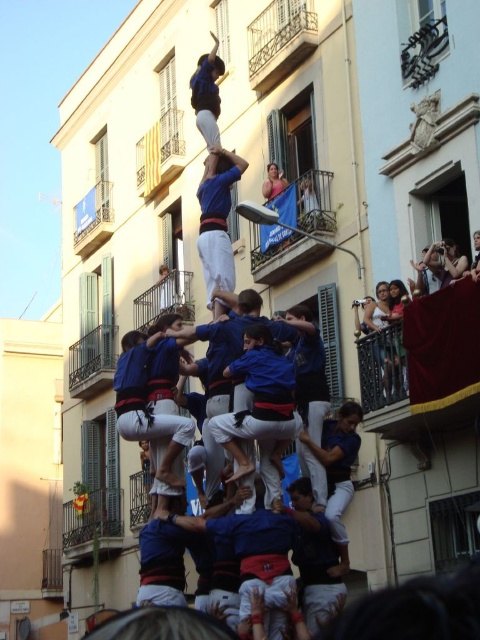
Which is below, metallic railing at upper center or matte blue shirt at upper center?

matte blue shirt at upper center is lower down.

This screenshot has height=640, width=480. Find the location of `metallic railing at upper center`. metallic railing at upper center is located at coordinates (279, 42).

Consider the image. Measure the distance from metallic railing at upper center to blue fabric at center.

metallic railing at upper center is 74.93 feet away from blue fabric at center.

Does point (289, 29) come in front of point (230, 170)?

That is False.

This screenshot has height=640, width=480. What are the coordinates of `metallic railing at upper center` in the screenshot? It's located at (279, 42).

From the picture: Is blue fabric at center positioned at the back of matte blue shirt at upper center?

No, blue fabric at center is in front of matte blue shirt at upper center.

Between blue fabric at center and matte blue shirt at upper center, which one appears on the left side from the viewer's perspective?

matte blue shirt at upper center

This screenshot has height=640, width=480. Identify the location of blue fabric at center. (217, 224).

At what (x,y) coordinates should I click in order to perform the action: click on blue fabric at center. Please return your answer as a coordinate pair (x, y). Looking at the image, I should click on (217, 224).